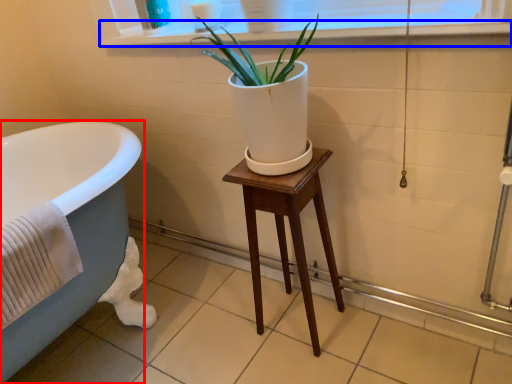
Question: Which object is closer to the camera taking this photo, bathtub (highlighted by a red box) or window sill (highlighted by a blue box)?

Choices:
 (A) bathtub
 (B) window sill

Answer: (B)